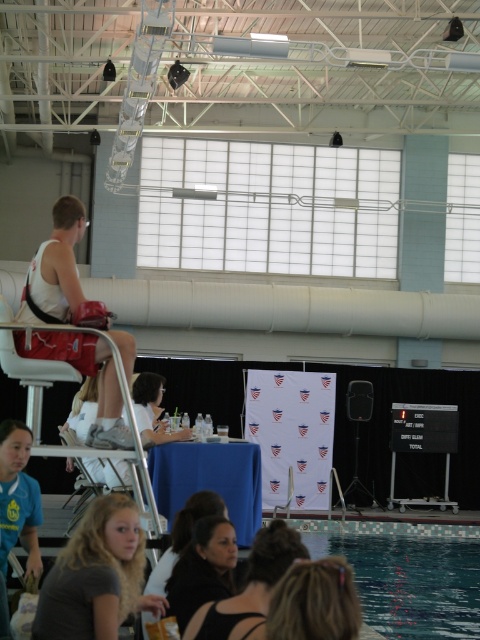
Does blonde hair at lower left have a lesser height compared to black fabric hair at center?

No.

Identify the location of blonde hair at lower left. (96, 576).

Between point (123, 612) and point (207, 573), which one is positioned behind?

Positioned behind is point (207, 573).

In order to click on blonde hair at lower left in this screenshot , I will do `click(96, 576)`.

Between point (261, 605) and point (190, 573), which one is positioned in front?

Point (261, 605) is in front.

Which is behind, point (240, 637) or point (200, 541)?

Point (200, 541)

Which is in front, point (244, 593) or point (187, 588)?

Point (244, 593) is in front.

At what (x,y) coordinates should I click in order to perform the action: click on dark brown hair at center. Please return your answer as a coordinate pair (x, y). Image resolution: width=480 pixels, height=640 pixels. Looking at the image, I should click on (251, 588).

Which is below, blonde hair at lower center or dark brown hair at center?

dark brown hair at center is lower down.

The width and height of the screenshot is (480, 640). I want to click on blonde hair at lower center, so click(314, 602).